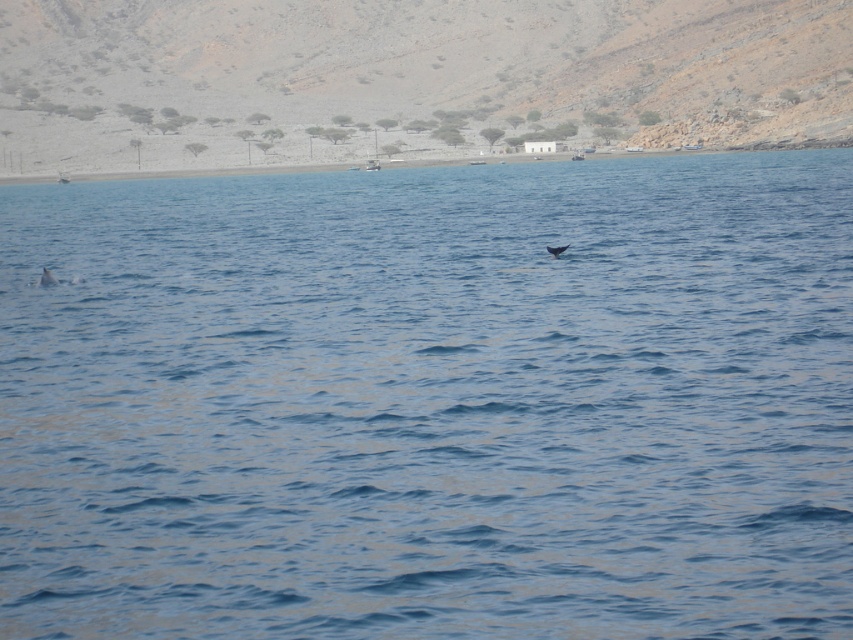
Which is more to the left, light gray dolphin at left or gray matte whale at center?

Positioned to the left is light gray dolphin at left.

Is point (42, 280) more distant than point (556, 248)?

No, (42, 280) is closer to viewer.

Where is `light gray dolphin at left`? The width and height of the screenshot is (853, 640). light gray dolphin at left is located at coordinates (47, 278).